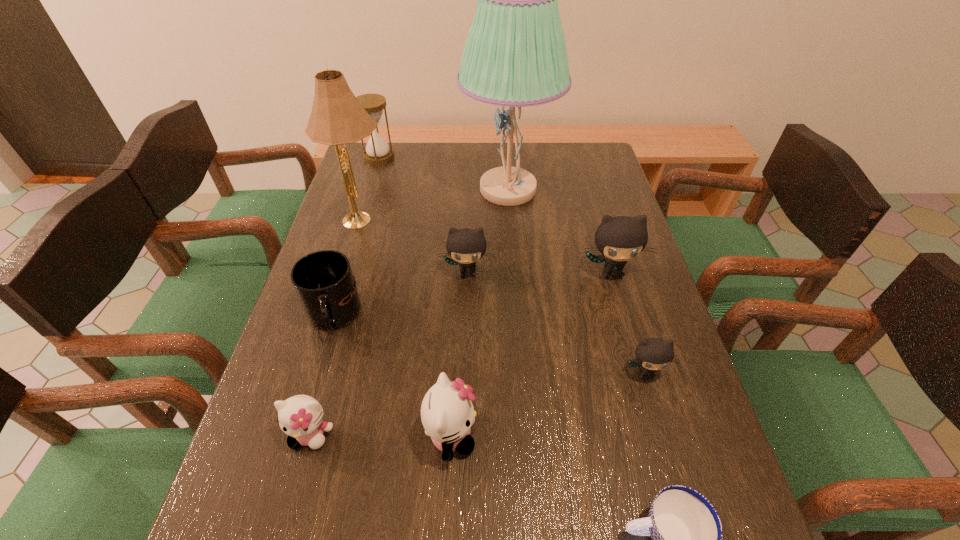
The height and width of the screenshot is (540, 960). Identify the location of the tallest object. (515, 55).

Image resolution: width=960 pixels, height=540 pixels. I want to click on teal lamp, so click(x=515, y=55).

At what (x,y) coordinates should I click in order to perform the action: click on the second tallest object. Please return your answer as a coordinate pair (x, y). Looking at the image, I should click on (337, 117).

You are a GUI agent. You are given a task and a screenshot of the screen. Output one action in this format:
    pyautogui.click(x=<x>, y=<y>)
    Task: Click on the lampshade
    The height and width of the screenshot is (540, 960).
    Given the screenshot: What is the action you would take?
    pyautogui.click(x=337, y=117)

The image size is (960, 540). In order to click on white hourglass in this screenshot , I will do `click(377, 152)`.

Locate an element on the screen. the biggest gray kitten is located at coordinates (619, 239).

The image size is (960, 540). Identify the location of the bigger white kitten. pyautogui.click(x=447, y=413).

What are the coordinates of `the second smallest gray kitten` in the screenshot? It's located at (465, 246).

Where is `mug`? mug is located at coordinates (323, 280).

This screenshot has width=960, height=540. In order to click on black mug in this screenshot , I will do `click(323, 280)`.